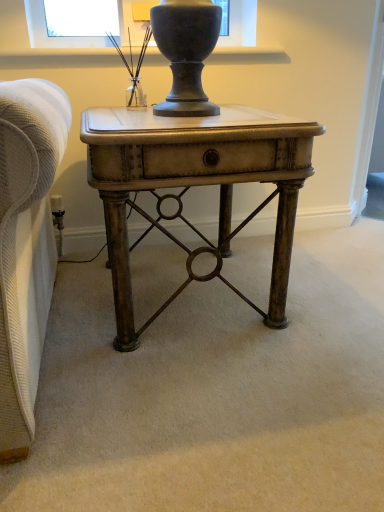
Question: From a real-world perspective, is matte black table lamp at upper center physically located above or below antique brass desk at center?

Choices:
 (A) above
 (B) below

Answer: (A)

Question: Would you say matte black table lamp at upper center is to the left or to the right of antique brass desk at center in the picture?

Choices:
 (A) right
 (B) left

Answer: (B)

Question: Is matte black table lamp at upper center inside the boundaries of antique brass desk at center, or outside?

Choices:
 (A) inside
 (B) outside

Answer: (B)

Question: Is point (248, 169) closer or farther from the camera than point (147, 44)?

Choices:
 (A) farther
 (B) closer

Answer: (B)

Question: From a real-world perspective, is antique brass desk at center physically located above or below matte black table lamp at upper center?

Choices:
 (A) below
 (B) above

Answer: (A)

Question: Considering the positions of antique brass desk at center and matte black table lamp at upper center in the image, is antique brass desk at center taller or shorter than matte black table lamp at upper center?

Choices:
 (A) tall
 (B) short

Answer: (A)

Question: From the image's perspective, relative to matte black table lamp at upper center, is antique brass desk at center above or below?

Choices:
 (A) above
 (B) below

Answer: (B)